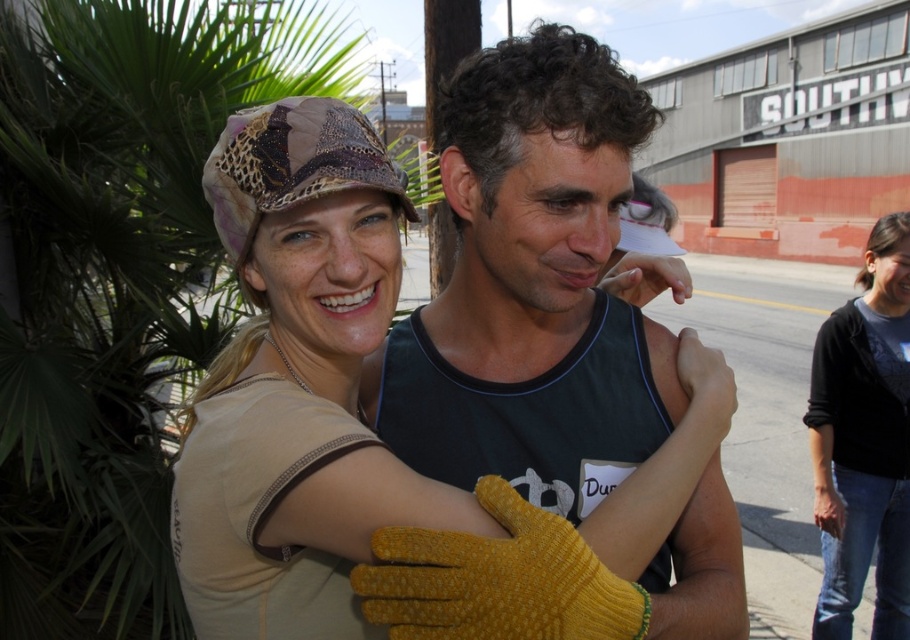
You are a photographer setting up a tripod to capture a group photo. You notice the matte green tank top at center and the black cotton shirt at lower right in the frame. Which clothing item should you adjust to ensure both are visible in the photo?

The matte green tank top at center has a lesser height compared to the black cotton shirt at lower right, so you should adjust the matte green tank top at center to a higher position to ensure both are visible in the photo.